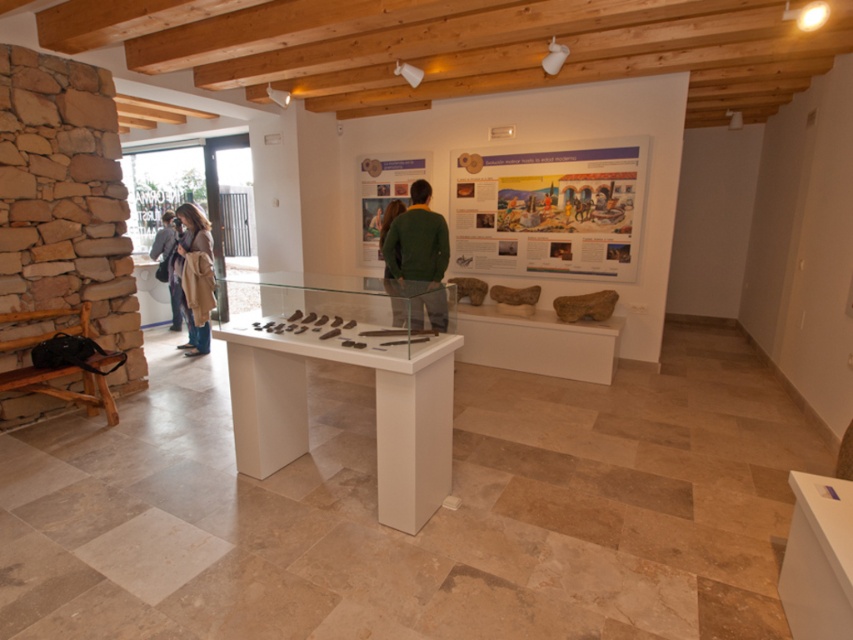
Question: Which of the following is the closest to the observer?

Choices:
 (A) green matte sweater at center
 (B) brown leather jacket at center

Answer: (A)

Question: Does green matte sweater at center come in front of brown leather jacket at center?

Choices:
 (A) no
 (B) yes

Answer: (B)

Question: Does green matte sweater at center have a greater width compared to brown leather jacket at center?

Choices:
 (A) yes
 (B) no

Answer: (B)

Question: Which of the following is the farthest from the observer?

Choices:
 (A) brown woolen coat at center
 (B) brown leather jacket at center

Answer: (B)

Question: Which of these objects is positioned farthest from the brown woolen coat at center?

Choices:
 (A) green matte sweater at center
 (B) brown leather jacket at center

Answer: (A)

Question: Can you confirm if green matte sweater at center is positioned above brown woolen coat at center?

Choices:
 (A) yes
 (B) no

Answer: (A)